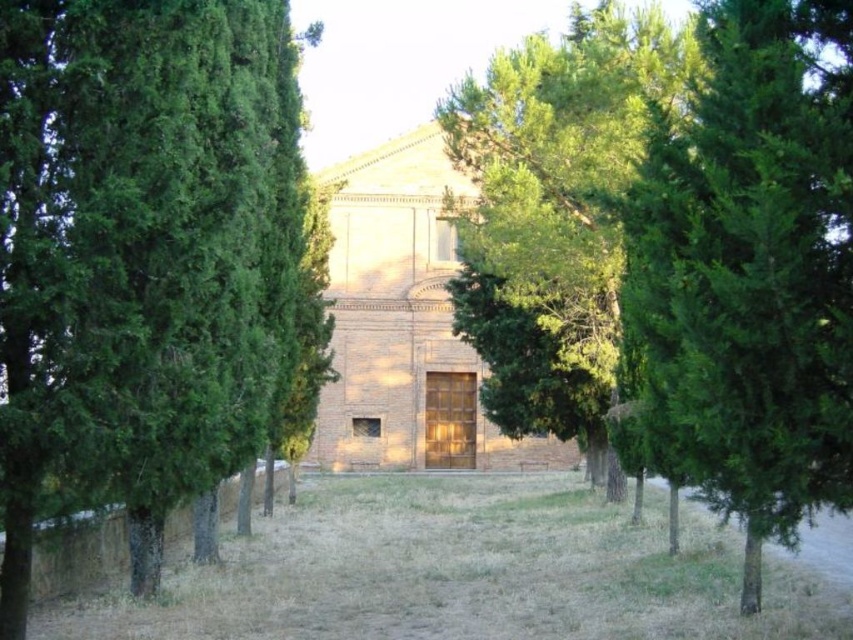
Question: Which point appears farthest from the camera in this image?

Choices:
 (A) (720, 108)
 (B) (660, 26)
 (C) (637, 532)
 (D) (102, 355)

Answer: (B)

Question: Considering the relative positions of green textured tree at left and green textured tree at center in the image provided, where is green textured tree at left located with respect to green textured tree at center?

Choices:
 (A) left
 (B) right

Answer: (A)

Question: Can you confirm if green textured tree at center is positioned above green leafy tree at center?

Choices:
 (A) yes
 (B) no

Answer: (B)

Question: Which object is positioned farthest from the green textured tree at center?

Choices:
 (A) green textured tree at left
 (B) green leafy tree at center
 (C) dry grass at center

Answer: (B)

Question: Among these points, which one is farthest from the camera?

Choices:
 (A) (769, 548)
 (B) (114, 106)
 (C) (819, 204)
 (D) (561, 170)

Answer: (D)

Question: Can you confirm if green textured tree at left is wider than green leafy tree at center?

Choices:
 (A) no
 (B) yes

Answer: (A)